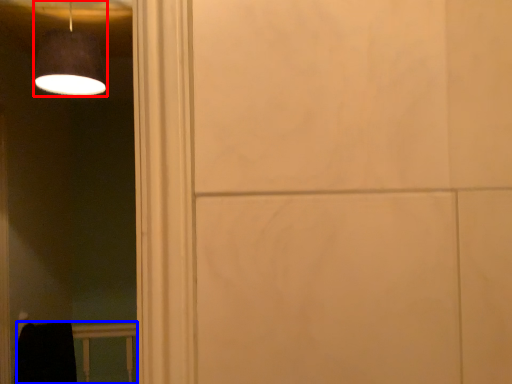
Question: Which of the following is the farthest to the observer, lamp (highlighted by a red box) or balustrade (highlighted by a blue box)?

Choices:
 (A) lamp
 (B) balustrade

Answer: (B)